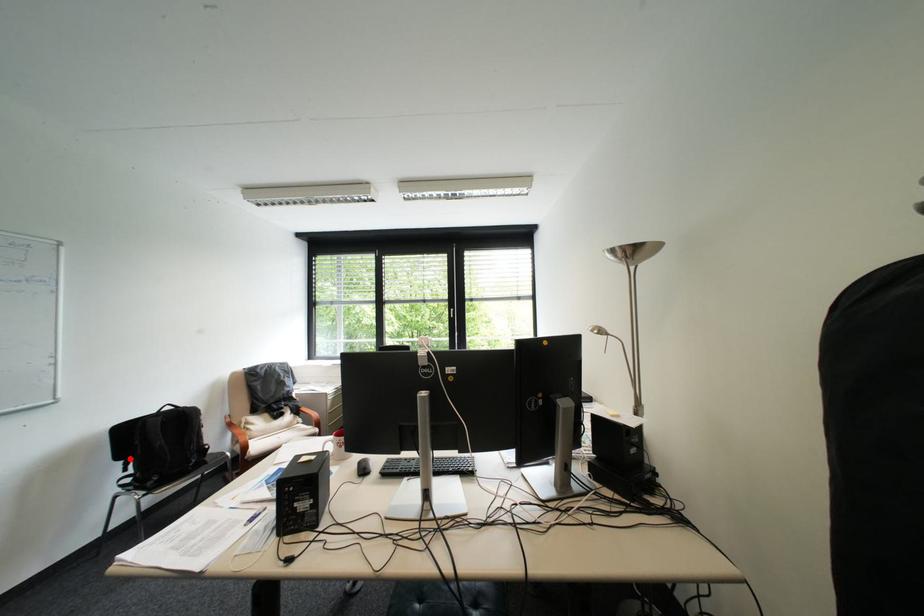
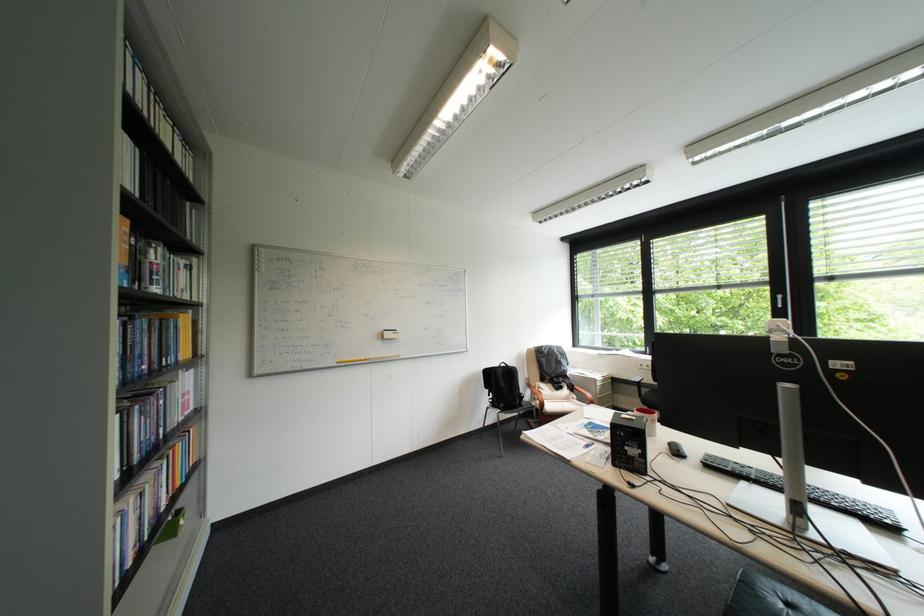
The point at the highlighted location is marked in the first image. Where is the corresponding point in the second image?

(497, 387)